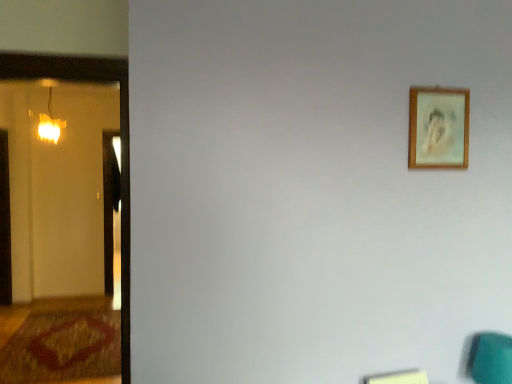
Question: Looking at the image, does wooden picture frame at upper right seem bigger or smaller compared to teal fabric swivel chair at lower right?

Choices:
 (A) big
 (B) small

Answer: (B)

Question: Is wooden picture frame at upper right spatially inside teal fabric swivel chair at lower right, or outside of it?

Choices:
 (A) inside
 (B) outside

Answer: (B)

Question: Which object is positioned closest to the matte glass lamp at left?

Choices:
 (A) wooden picture frame at upper right
 (B) brown textured rug at lower left
 (C) teal fabric swivel chair at lower right

Answer: (B)

Question: Estimate the real-world distances between objects in this image. Which object is farther from the teal fabric swivel chair at lower right?

Choices:
 (A) wooden picture frame at upper right
 (B) brown textured rug at lower left
 (C) matte glass lamp at left

Answer: (C)